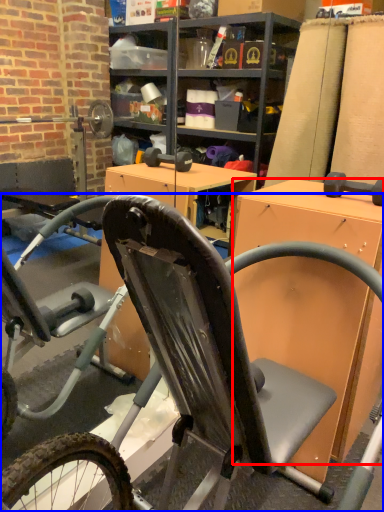
Question: Among these objects, which one is farthest to the camera, desk (highlighted by a red box) or bicycle (highlighted by a blue box)?

Choices:
 (A) desk
 (B) bicycle

Answer: (A)